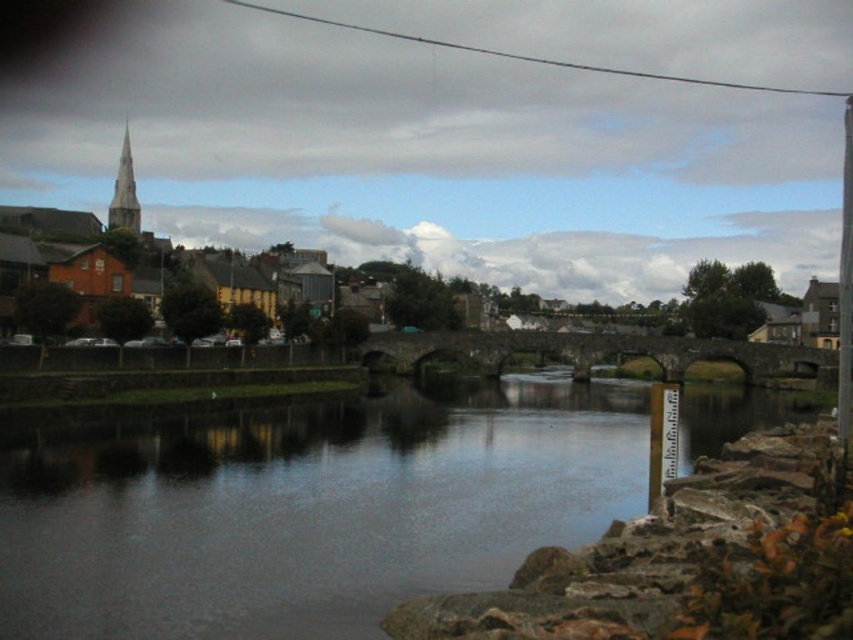
Is smooth concrete river at center wider than smooth gray spire at upper left?

No.

Is smooth concrete river at center to the left of smooth gray spire at upper left from the viewer's perspective?

Incorrect, smooth concrete river at center is not on the left side of smooth gray spire at upper left.

What do you see at coordinates (306, 508) in the screenshot?
I see `smooth concrete river at center` at bounding box center [306, 508].

In order to click on smooth concrete river at center in this screenshot , I will do `click(306, 508)`.

Who is positioned more to the right, smooth concrete river at center or brown wooden houses at upper left?

smooth concrete river at center

Does smooth concrete river at center appear on the left side of brown wooden houses at upper left?

Incorrect, smooth concrete river at center is not on the left side of brown wooden houses at upper left.

What do you see at coordinates (306, 508) in the screenshot?
I see `smooth concrete river at center` at bounding box center [306, 508].

Image resolution: width=853 pixels, height=640 pixels. Identify the location of smooth concrete river at center. (306, 508).

Is brown wooden houses at upper left taller than smooth gray spire at upper left?

Yes.

Identify the location of brown wooden houses at upper left. The width and height of the screenshot is (853, 640). (505, 227).